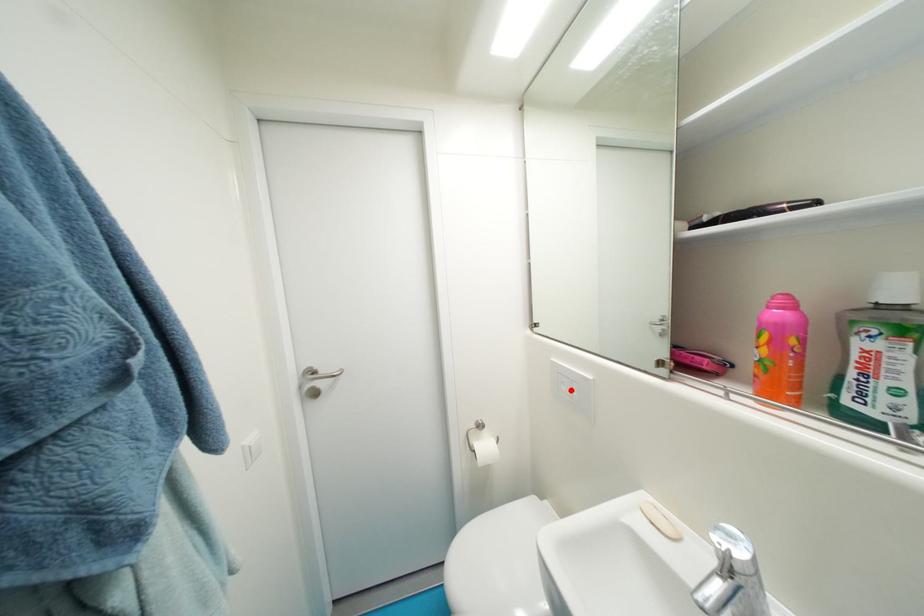
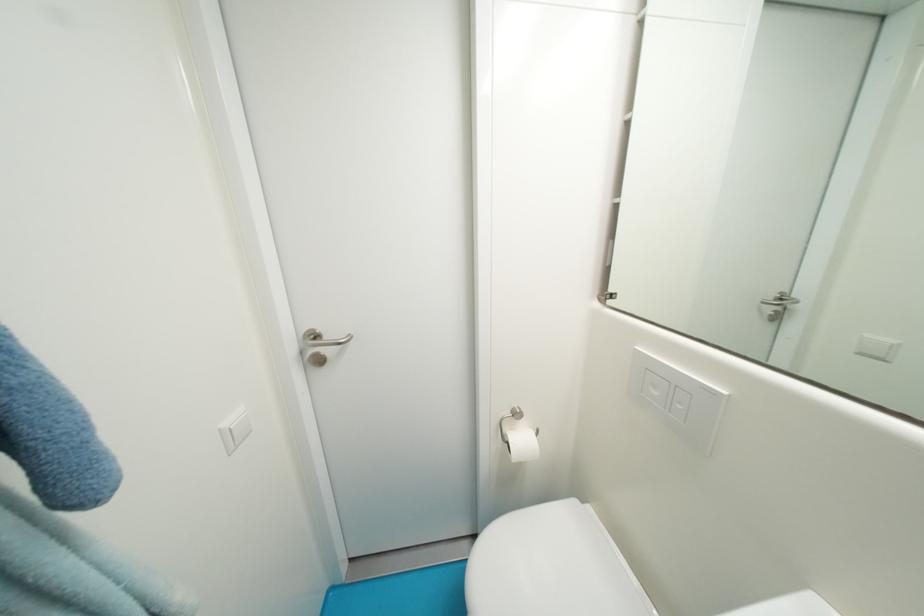
Find the pixel in the second image that matches the highlighted location in the first image.

(662, 395)